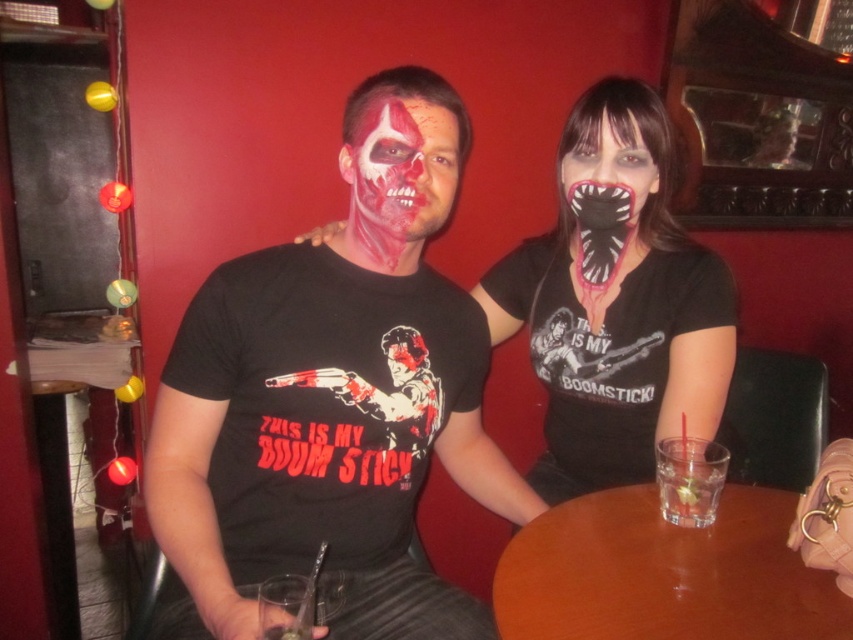
You are a photographer trying to capture a closeup shot of the matte red face paint at center. The brown wooden table at center is blocking your view. Can you move the table to get a better angle?

The brown wooden table at center is larger in size than matte red face paint at center, so moving it might be necessary to get an unobstructed view of the face paint.